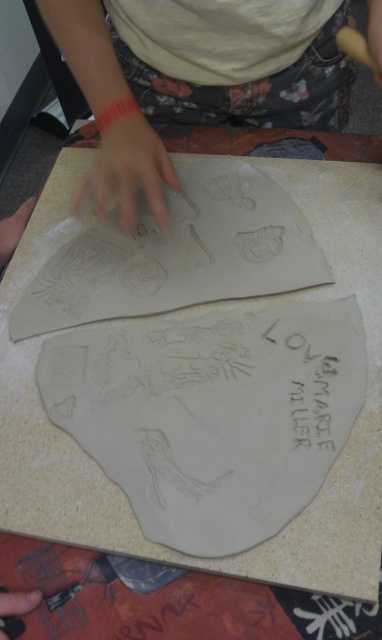
Between point (0, 225) and point (367, 1), which one is positioned behind?

Point (367, 1)

Find the location of a particular element. This screenshot has width=382, height=640. matte gray clay hand at upper left is located at coordinates (14, 230).

Does matte gray clay hand at upper left have a greater width compared to black matte hand at lower left?

Correct, the width of matte gray clay hand at upper left exceeds that of black matte hand at lower left.

What do you see at coordinates (14, 230) in the screenshot? The image size is (382, 640). I see `matte gray clay hand at upper left` at bounding box center [14, 230].

Where is `matte gray clay hand at upper left`? The height and width of the screenshot is (640, 382). matte gray clay hand at upper left is located at coordinates (14, 230).

Find the location of `matte gray clay hand at upper left`. matte gray clay hand at upper left is located at coordinates (14, 230).

In the scene shown: Is matte gray hand at upper center positioned in front of matte gray clay hand at upper left?

Yes.

Which is in front, point (165, 180) or point (1, 240)?

Positioned in front is point (165, 180).

Locate an element on the screen. This screenshot has width=382, height=640. matte gray hand at upper center is located at coordinates (127, 172).